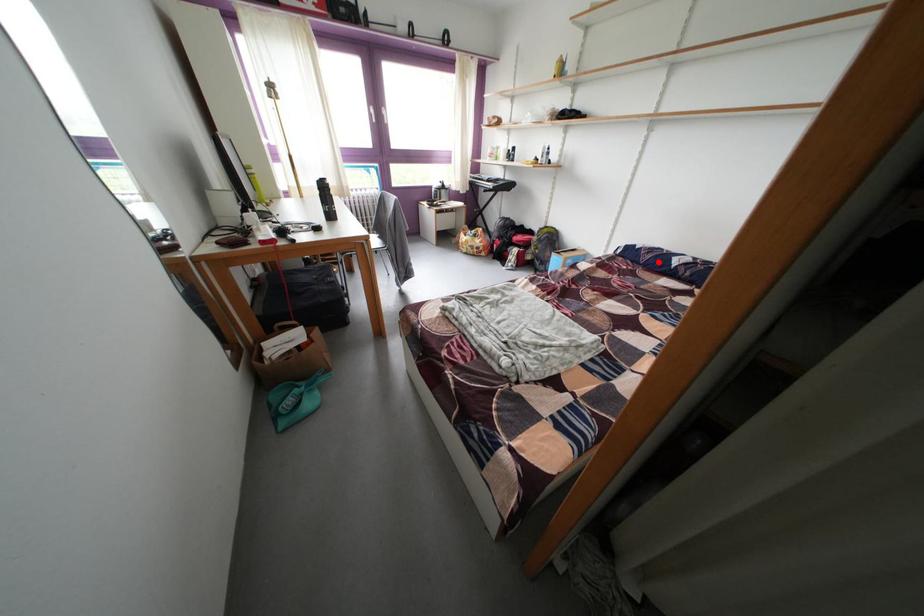
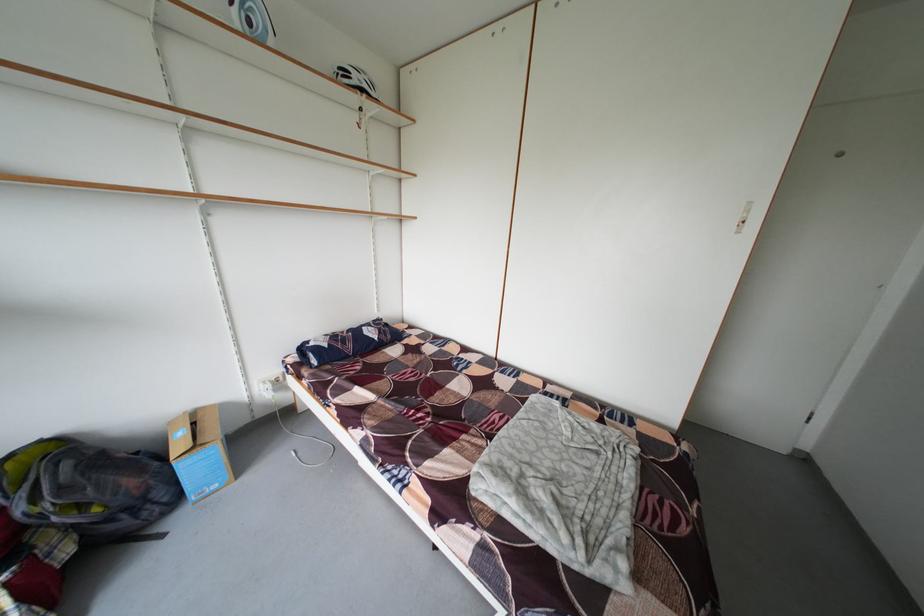
Question: I am providing you with two images of the same scene from different viewpoints. In image1, a red point is highlighted. Considering the same 3D point in image2, which of the following is correct?

Choices:
 (A) It is closer
 (B) It is farther

Answer: (B)